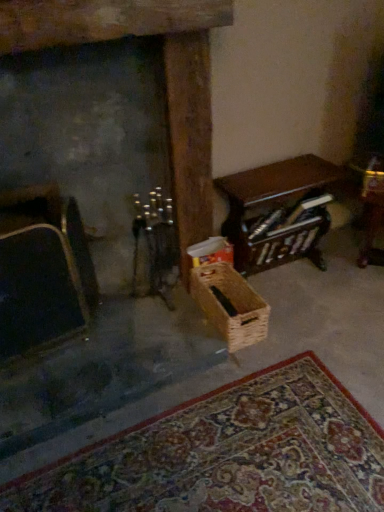
I want to click on free location in front of velvet black armchair at left, so click(46, 385).